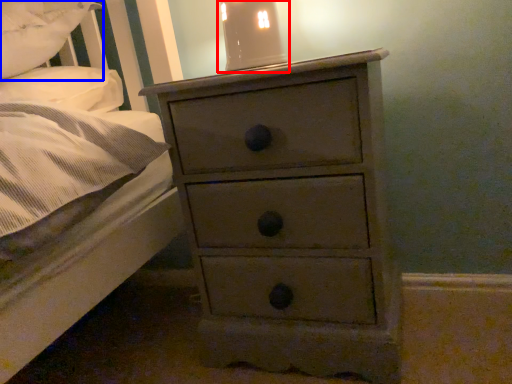
Question: Which object is closer to the camera taking this photo, bedside lamp (highlighted by a red box) or pillow (highlighted by a blue box)?

Choices:
 (A) bedside lamp
 (B) pillow

Answer: (B)